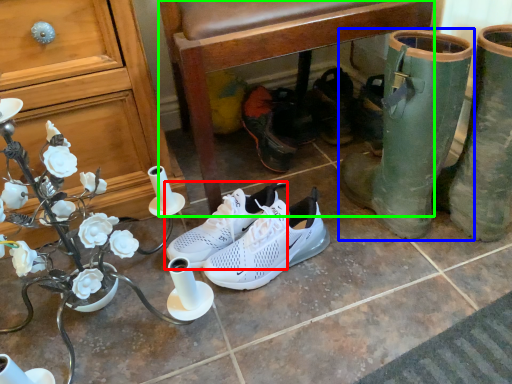
Question: Which object is the farthest from footwear (highlighted by a red box)? Choose among these: footwear (highlighted by a blue box) or chair (highlighted by a green box).

Choices:
 (A) footwear
 (B) chair

Answer: (A)